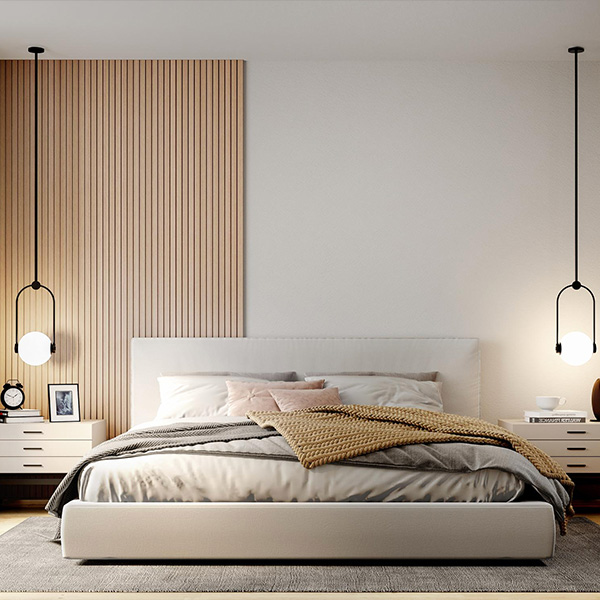
Where is `bed`? This screenshot has width=600, height=600. bed is located at coordinates (252, 469).